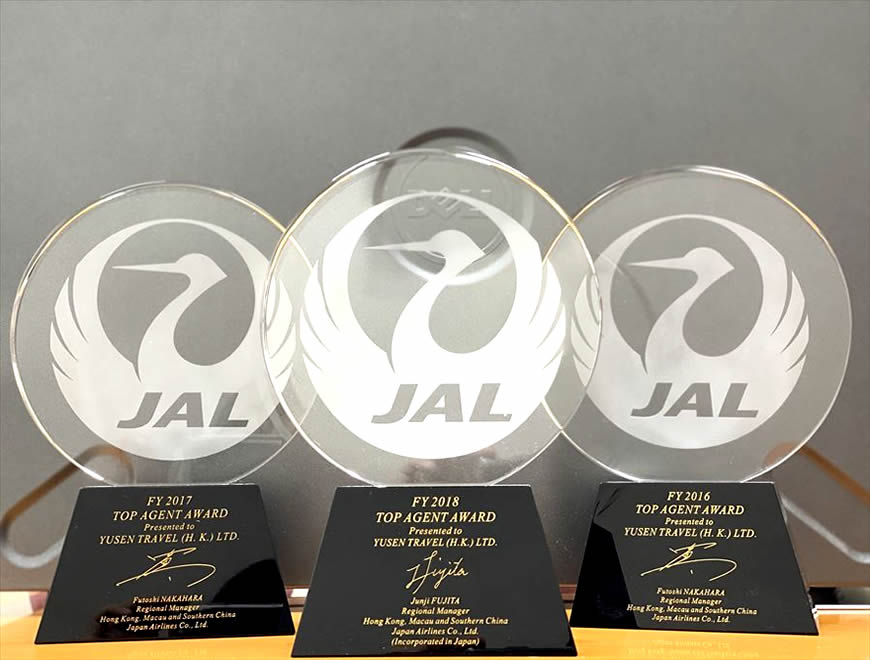
In order to click on trophies in this screenshot , I will do `click(170, 546)`, `click(400, 554)`, `click(687, 560)`.